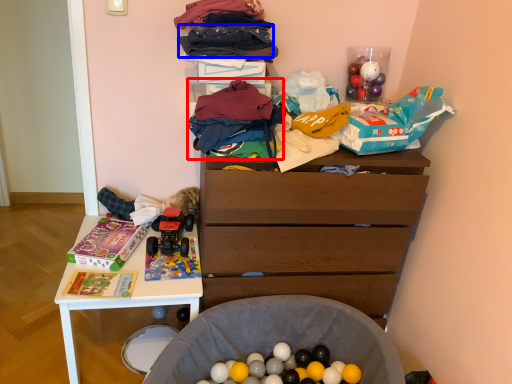
Question: Which point is further to the camera, clothing (highlighted by a red box) or clothing (highlighted by a blue box)?

Choices:
 (A) clothing
 (B) clothing

Answer: (B)